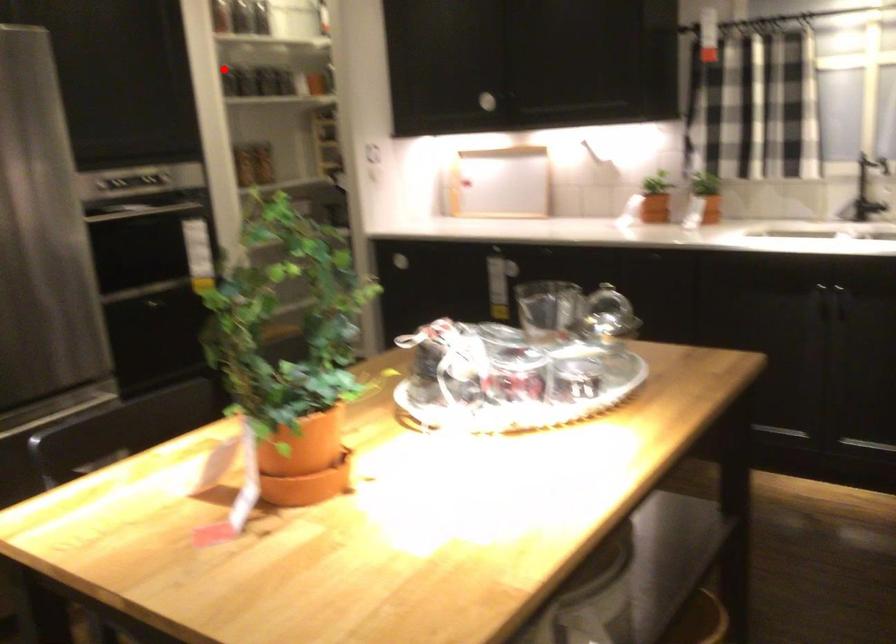
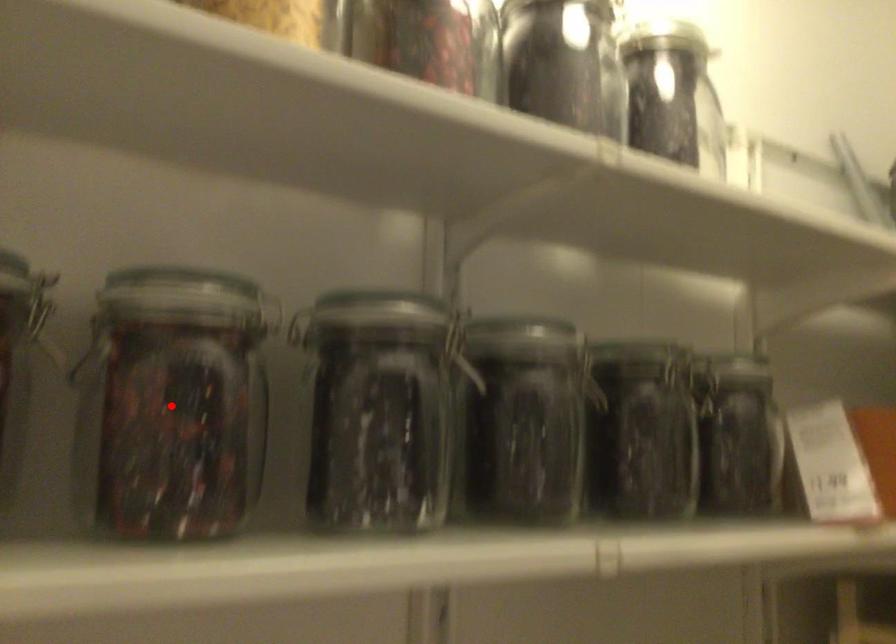
I am providing you with two images of the same scene from different viewpoints. A red point is marked on the first image and another point is marked on the second image. Do the highlighted points in image1 and image2 indicate the same real-world spot?

No